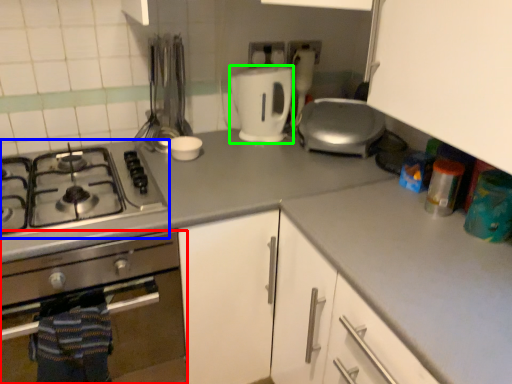
Question: Which object is positioned closest to kitchen appliance (highlighted by a red box)? Select from gas stove (highlighted by a blue box) and kitchen appliance (highlighted by a green box).

Choices:
 (A) gas stove
 (B) kitchen appliance

Answer: (A)